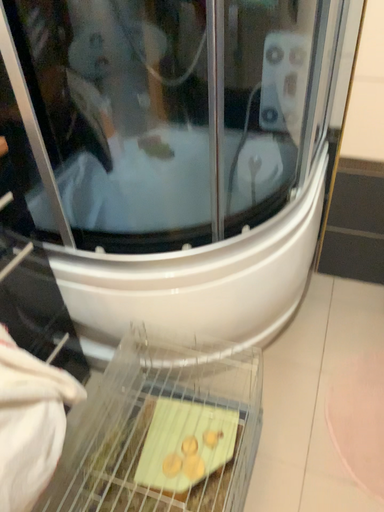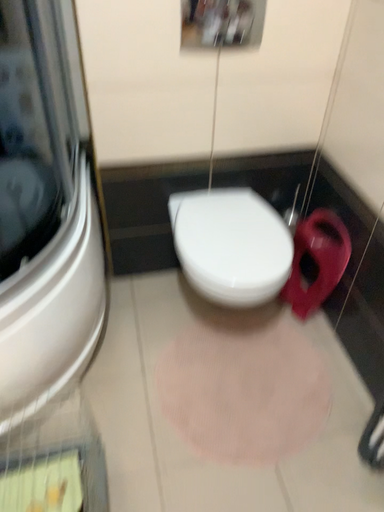
Question: Which way did the camera rotate in the video?

Choices:
 (A) rotated left
 (B) rotated right

Answer: (B)